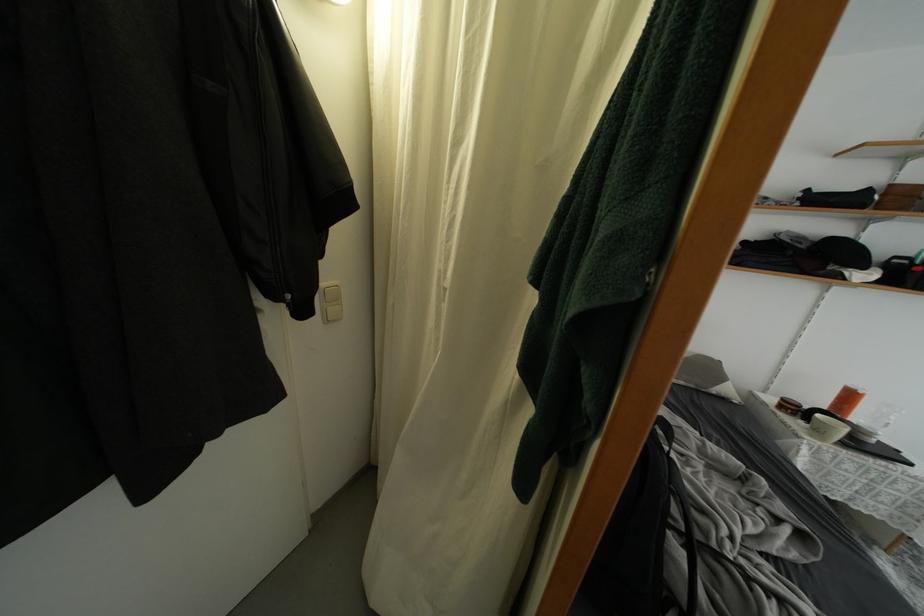
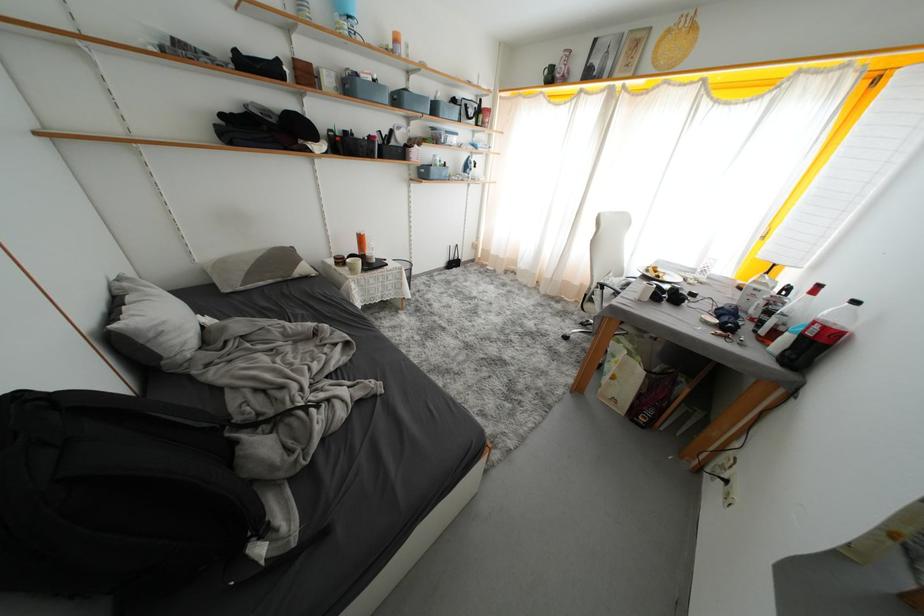
Based on the continuous images, in which direction is the camera rotating?

The camera rotated toward right-down.